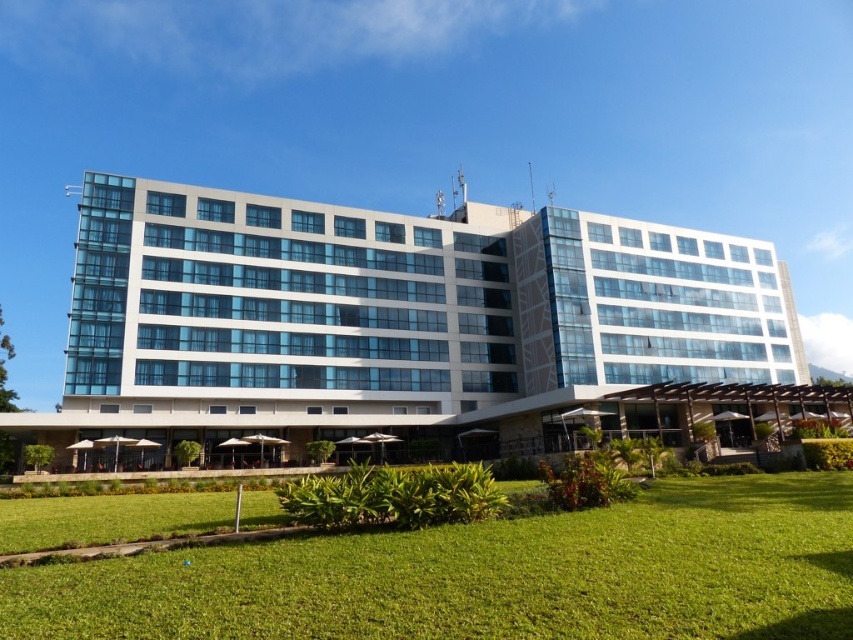
Who is positioned more to the right, white glass building at center or green grass at lower center?

white glass building at center is more to the right.

I want to click on white glass building at center, so click(390, 316).